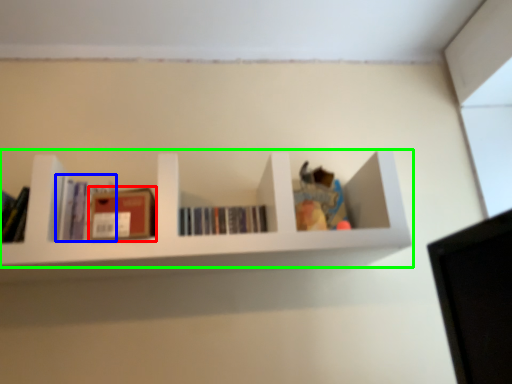
Question: Which is nearer to the paperback book (highlighted by a red box)? book (highlighted by a blue box) or shelf (highlighted by a green box).

Choices:
 (A) book
 (B) shelf

Answer: (A)